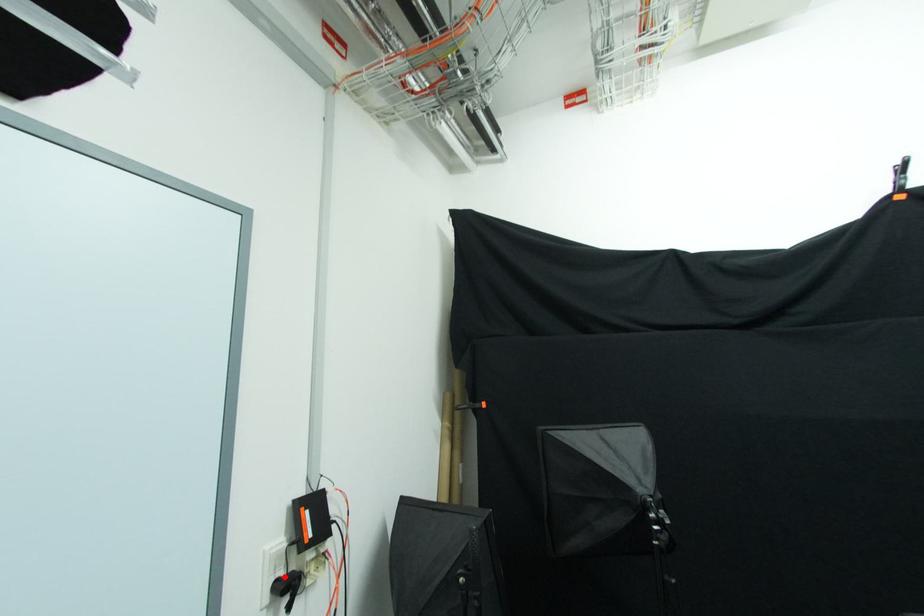
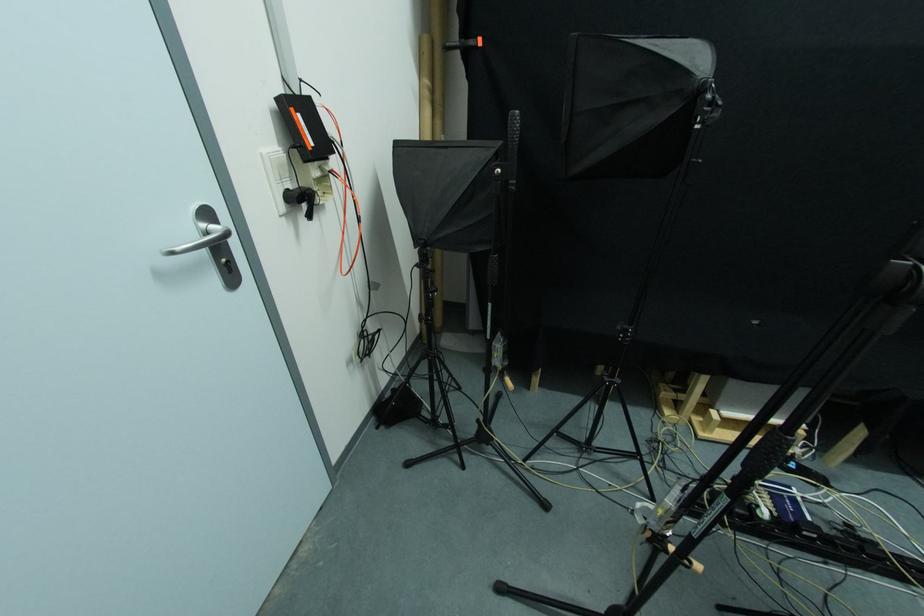
Find the pixel in the second image that matches the highlighted location in the first image.

(292, 188)